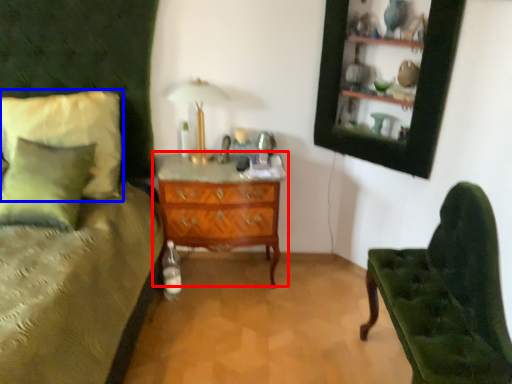
Question: Which of the following is the farthest to the observer, chest of drawers (highlighted by a red box) or pillow (highlighted by a blue box)?

Choices:
 (A) chest of drawers
 (B) pillow

Answer: (A)